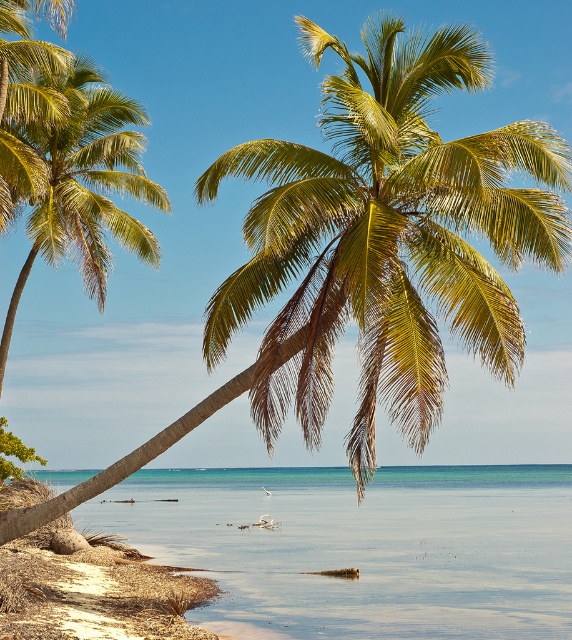
You are a photographer planning to capture the entire scene of the clear blue water at center and the green leafy palm tree at left. Given their sizes, which object should you focus on to ensure both fit in the frame?

The clear blue water at center has a larger size compared to the green leafy palm tree at left, so you should focus on the clear blue water at center to ensure both objects fit in the frame.